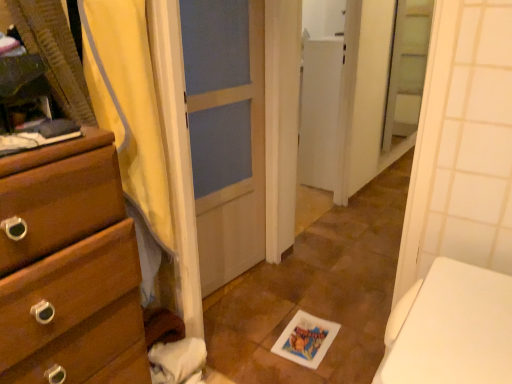
Question: Is clear glass screen door at upper right taller than yellow fabric shower curtain at left?

Choices:
 (A) no
 (B) yes

Answer: (B)

Question: Is clear glass screen door at upper right behind yellow fabric shower curtain at left?

Choices:
 (A) yes
 (B) no

Answer: (A)

Question: From a real-world perspective, is clear glass screen door at upper right located higher than yellow fabric shower curtain at left?

Choices:
 (A) yes
 (B) no

Answer: (B)

Question: Are clear glass screen door at upper right and yellow fabric shower curtain at left beside each other?

Choices:
 (A) yes
 (B) no

Answer: (B)

Question: From the image's perspective, is clear glass screen door at upper right on yellow fabric shower curtain at left?

Choices:
 (A) no
 (B) yes

Answer: (B)

Question: Does point (418, 41) appear closer or farther from the camera than point (115, 382)?

Choices:
 (A) closer
 (B) farther

Answer: (B)

Question: Is clear glass screen door at upper right bigger or smaller than wooden chest of drawers at left?

Choices:
 (A) big
 (B) small

Answer: (B)

Question: Is clear glass screen door at upper right taller or shorter than wooden chest of drawers at left?

Choices:
 (A) tall
 (B) short

Answer: (A)

Question: Considering their positions, is clear glass screen door at upper right located in front of or behind wooden chest of drawers at left?

Choices:
 (A) behind
 (B) front

Answer: (A)

Question: Does point (153, 292) appear closer or farther from the camera than point (50, 273)?

Choices:
 (A) closer
 (B) farther

Answer: (B)

Question: From the image's perspective, is yellow fabric shower curtain at left above or below wooden chest of drawers at left?

Choices:
 (A) above
 (B) below

Answer: (A)

Question: Considering their positions, is yellow fabric shower curtain at left located in front of or behind wooden chest of drawers at left?

Choices:
 (A) front
 (B) behind

Answer: (B)

Question: Considering the positions of yellow fabric shower curtain at left and wooden chest of drawers at left in the image, is yellow fabric shower curtain at left taller or shorter than wooden chest of drawers at left?

Choices:
 (A) tall
 (B) short

Answer: (A)

Question: Is wooden chest of drawers at left bigger or smaller than yellow fabric shower curtain at left?

Choices:
 (A) small
 (B) big

Answer: (B)

Question: Which is correct: wooden chest of drawers at left is inside yellow fabric shower curtain at left, or outside of it?

Choices:
 (A) inside
 (B) outside

Answer: (B)